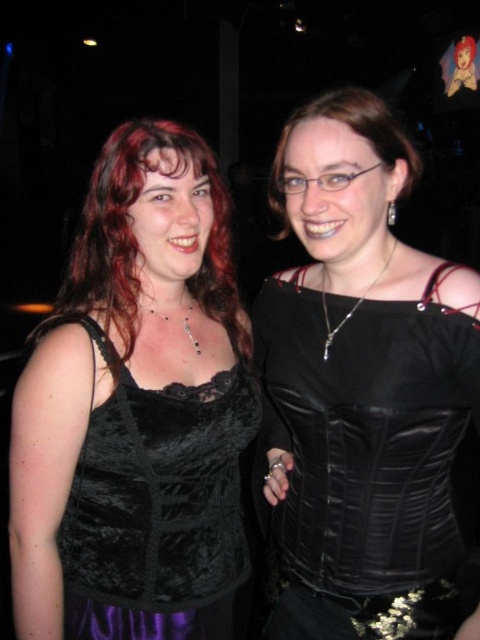
Question: Among these objects, which one is farthest from the camera?

Choices:
 (A) satin black corset at center
 (B) velvet black top at left
 (C) matte black corset at center
 (D) matte black lace top at left

Answer: (D)

Question: Does velvet black top at left have a smaller size compared to matte black lace top at left?

Choices:
 (A) yes
 (B) no

Answer: (B)

Question: Which object is the closest to the matte black lace top at left?

Choices:
 (A) satin black corset at center
 (B) matte black corset at center

Answer: (B)

Question: Can you confirm if velvet black top at left is wider than matte black lace top at left?

Choices:
 (A) no
 (B) yes

Answer: (A)

Question: Which point is farther to the camera?

Choices:
 (A) velvet black top at left
 (B) matte black lace top at left
 (C) matte black corset at center

Answer: (B)

Question: Does satin black corset at center appear over matte black lace top at left?

Choices:
 (A) yes
 (B) no

Answer: (B)